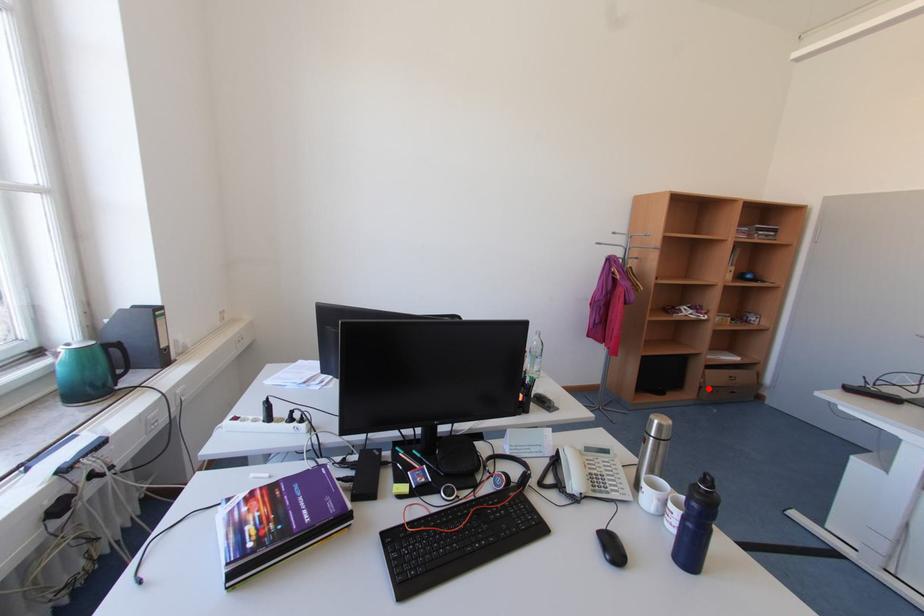
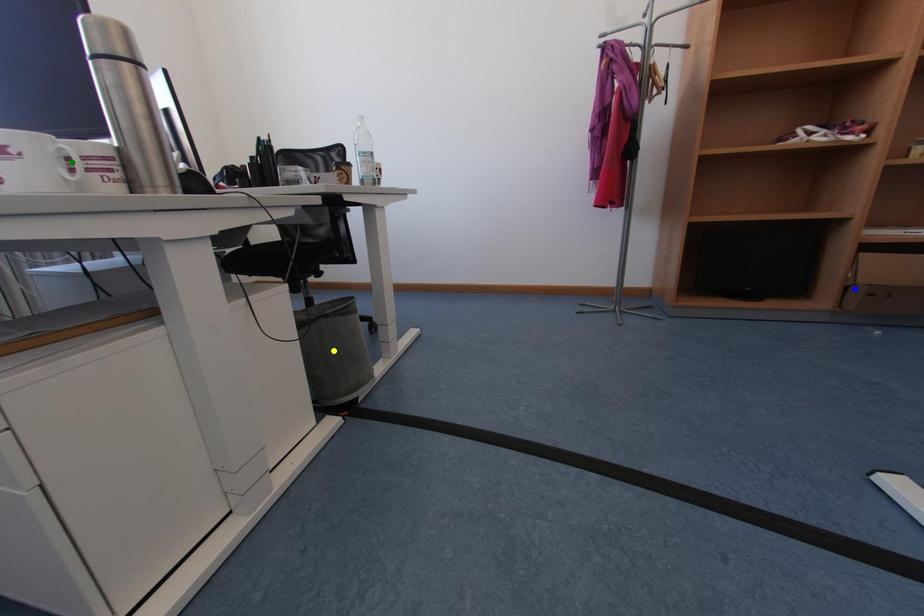
Question: I am providing you with two images of the same scene from different viewpoints. A red point is marked on the first image. You are given multiple points on the second image. Can you choose the point in image 2 that corresponds to the point in image 1?

Choices:
 (A) yellow point
 (B) green point
 (C) blue point

Answer: (C)